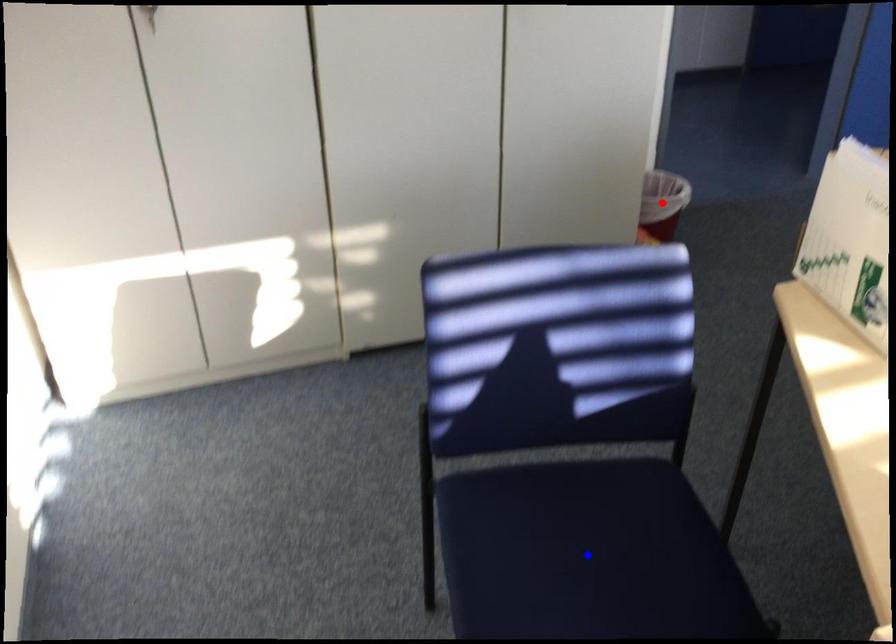
Question: Which of the two points in the image is closer to the camera?

Choices:
 (A) Blue point is closer.
 (B) Red point is closer.

Answer: (A)